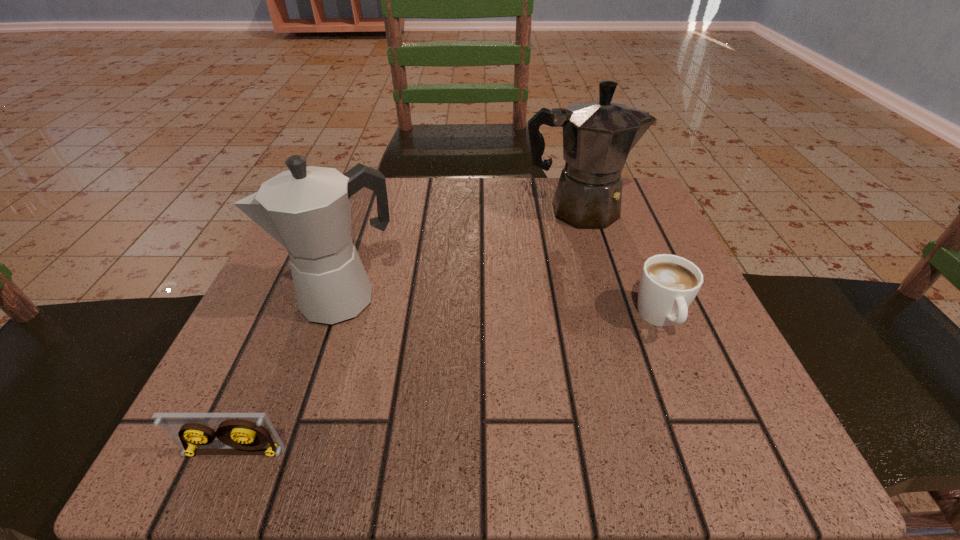
You are a GUI agent. You are given a task and a screenshot of the screen. Output one action in this format:
    pyautogui.click(x=<x>, y=<y>)
    Task: Click on the free space that is in between the farther coffeepot and the cappuccino
    Image resolution: width=960 pixels, height=540 pixels.
    Given the screenshot: What is the action you would take?
    pyautogui.click(x=619, y=264)

At what (x,y) coordinates should I click in order to perform the action: click on empty location between the nearest object and the left coffeepot. Please return your answer as a coordinate pair (x, y). The image size is (960, 540). Looking at the image, I should click on (289, 376).

Where is `empty space between the right coffeepot and the cappuccino`? empty space between the right coffeepot and the cappuccino is located at coordinates (619, 264).

I want to click on vacant area between the videotape and the left coffeepot, so click(x=289, y=376).

In order to click on unoccupied area between the nearest object and the left coffeepot in this screenshot , I will do `click(289, 376)`.

Identify the location of empty space that is in between the videotape and the left coffeepot. This screenshot has width=960, height=540. (289, 376).

Image resolution: width=960 pixels, height=540 pixels. Identify the location of empty space between the cappuccino and the nearest object. (447, 385).

Locate an element on the screen. free space between the cappuccino and the farthest object is located at coordinates (619, 264).

You are a GUI agent. You are given a task and a screenshot of the screen. Output one action in this format:
    pyautogui.click(x=<x>, y=<y>)
    Task: Click on the free point between the nearest object and the farthest object
    The image size is (960, 540).
    Given the screenshot: What is the action you would take?
    pyautogui.click(x=405, y=331)

Where is `free spot between the cappuccino and the left coffeepot`? free spot between the cappuccino and the left coffeepot is located at coordinates (502, 309).